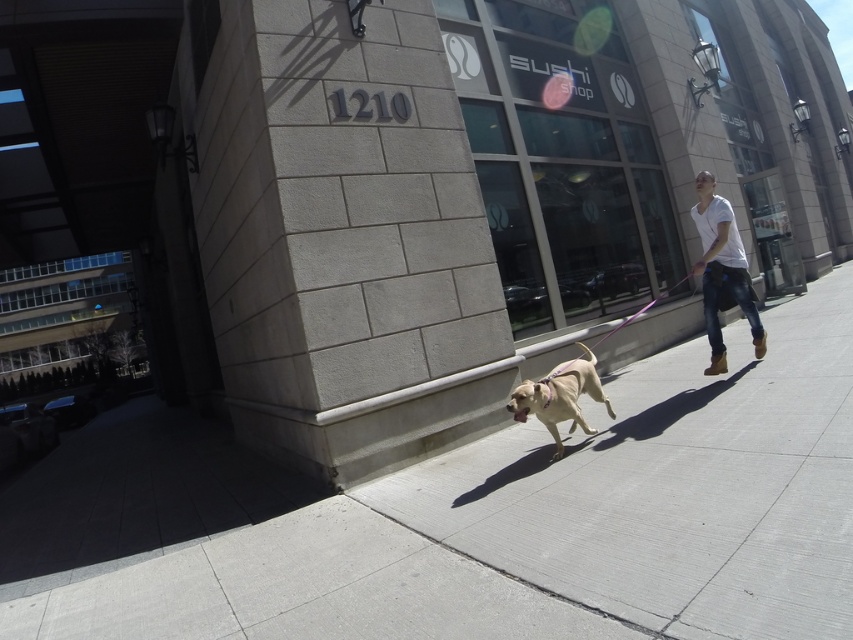
Question: Which of these objects is positioned closest to the golden fur dog at center?

Choices:
 (A) white cotton shirt at right
 (B) gray concrete sidewalk at lower center

Answer: (B)

Question: In this image, where is gray concrete sidewalk at lower center located relative to white cotton shirt at right?

Choices:
 (A) below
 (B) above

Answer: (A)

Question: Where is gray concrete sidewalk at lower center located in relation to golden fur dog at center in the image?

Choices:
 (A) below
 (B) above

Answer: (A)

Question: Which object is closer to the camera taking this photo?

Choices:
 (A) white cotton shirt at right
 (B) gray concrete sidewalk at lower center
 (C) golden fur dog at center

Answer: (B)

Question: Which of the following is the closest to the observer?

Choices:
 (A) (714, 316)
 (B) (479, 458)

Answer: (B)

Question: From the image, what is the correct spatial relationship of gray concrete sidewalk at lower center in relation to white cotton shirt at right?

Choices:
 (A) below
 (B) above

Answer: (A)